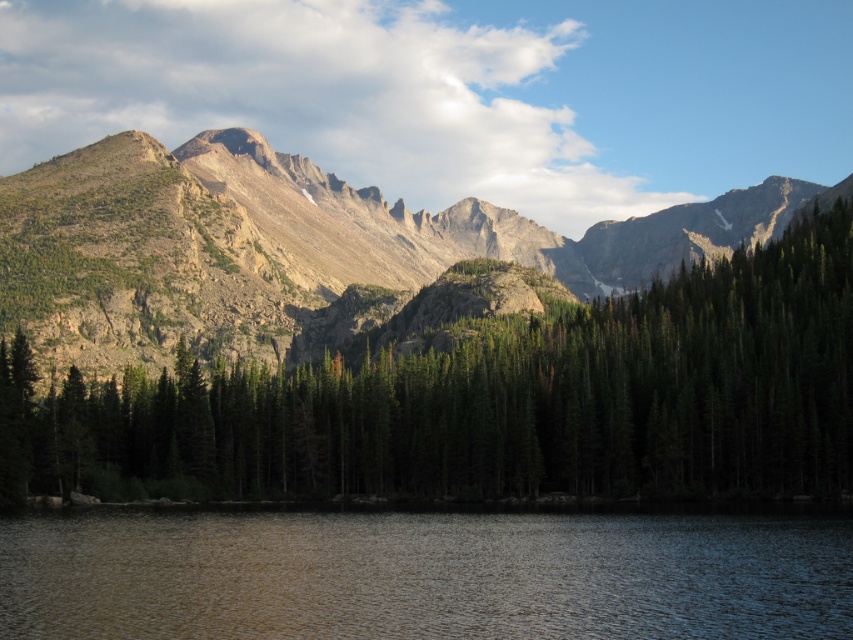
Is green matte tree at center closer to camera compared to smooth reflective water at lower center?

No, green matte tree at center is further to the viewer.

Between green matte tree at center and smooth reflective water at lower center, which one is positioned higher?

green matte tree at center is higher up.

Is point (676, 465) farther from viewer compared to point (378, 524)?

Yes, it is behind point (378, 524).

Find the location of a particular element. green matte tree at center is located at coordinates (490, 401).